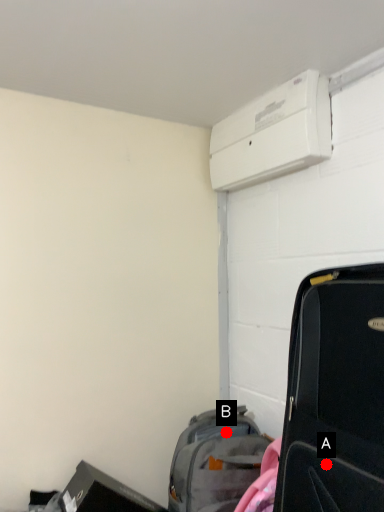
Question: Two points are circled on the image, labeled by A and B beside each circle. Which point is closer to the camera?

Choices:
 (A) A is closer
 (B) B is closer

Answer: (A)